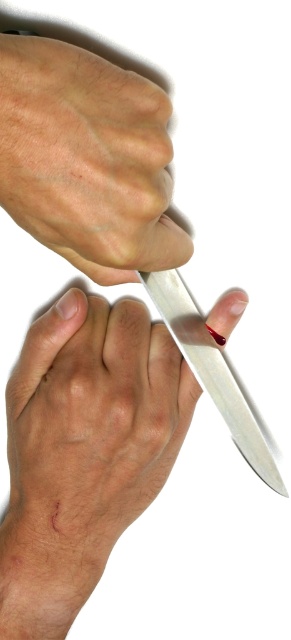
How far apart are smooth skin hand at center and polished metal knife at lower right?

They are 2.96 inches apart.

Between smooth skin hand at center and polished metal knife at lower right, which one appears on the left side from the viewer's perspective?

smooth skin hand at center

Is point (73, 378) more distant than point (174, 291)?

No, (73, 378) is in front of (174, 291).

Locate an element on the screen. smooth skin hand at center is located at coordinates (x=91, y=420).

Locate an element on the screen. The height and width of the screenshot is (640, 291). matte skin hand at upper center is located at coordinates (87, 160).

Who is positioned more to the right, matte skin hand at upper center or polished metal knife at lower right?

polished metal knife at lower right is more to the right.

Locate an element on the screen. This screenshot has height=640, width=291. matte skin hand at upper center is located at coordinates (87, 160).

Is smooth skin hand at center to the right of matte skin hand at upper center from the viewer's perspective?

No, smooth skin hand at center is not to the right of matte skin hand at upper center.

Between smooth skin hand at center and matte skin hand at upper center, which one appears on the right side from the viewer's perspective?

From the viewer's perspective, matte skin hand at upper center appears more on the right side.

At what (x,y) coordinates should I click in order to perform the action: click on smooth skin hand at center. Please return your answer as a coordinate pair (x, y). Looking at the image, I should click on pos(91,420).

The image size is (291, 640). Identify the location of smooth skin hand at center. (91, 420).